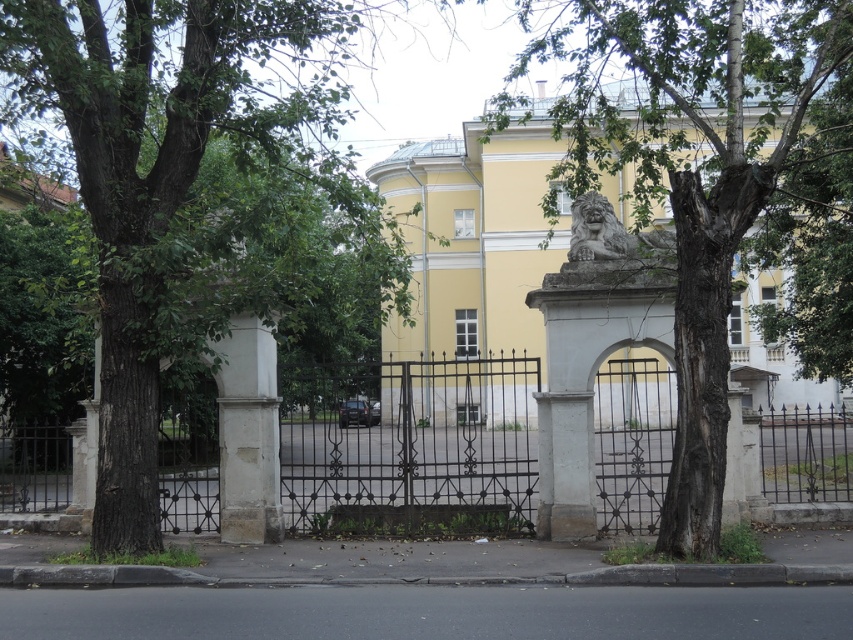
Consider the image. Who is lower down, black wrought iron gate at center or polished stone lion at center?

Positioned lower is black wrought iron gate at center.

Is point (648, 417) positioned after point (572, 234)?

Yes.

The height and width of the screenshot is (640, 853). What do you see at coordinates (409, 435) in the screenshot?
I see `black wrought iron gate at center` at bounding box center [409, 435].

This screenshot has width=853, height=640. Identify the location of black wrought iron gate at center. (409, 435).

Who is more distant from viewer, (260, 316) or (573, 212)?

The point (573, 212) is more distant.

Does green leafy tree at left have a lesser height compared to polished stone lion at center?

Incorrect, green leafy tree at left's height does not fall short of polished stone lion at center's.

This screenshot has width=853, height=640. What are the coordinates of `green leafy tree at left` in the screenshot? It's located at (173, 179).

Does green leafy tree at left have a lesser width compared to black wrought iron gate at center?

Yes, green leafy tree at left is thinner than black wrought iron gate at center.

Measure the distance from green leafy tree at left to black wrought iron gate at center.

8.70 meters

The width and height of the screenshot is (853, 640). What are the coordinates of `green leafy tree at left` in the screenshot? It's located at (173, 179).